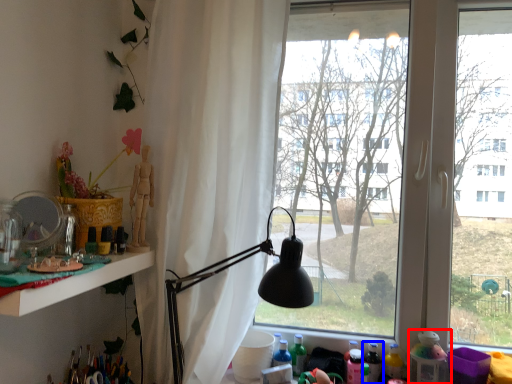
Question: Which object is closer to the camera taking this photo, toy (highlighted by a red box) or bottle (highlighted by a blue box)?

Choices:
 (A) toy
 (B) bottle

Answer: (A)